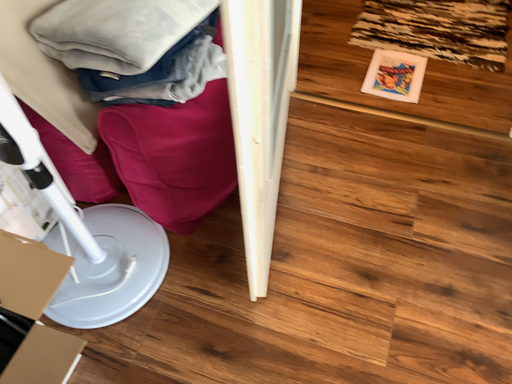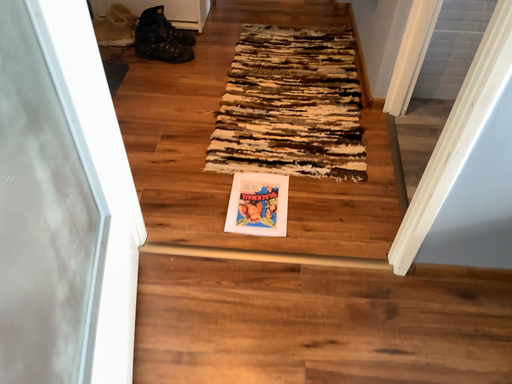
Question: How did the camera likely rotate when shooting the video?

Choices:
 (A) rotated upward
 (B) rotated downward

Answer: (A)